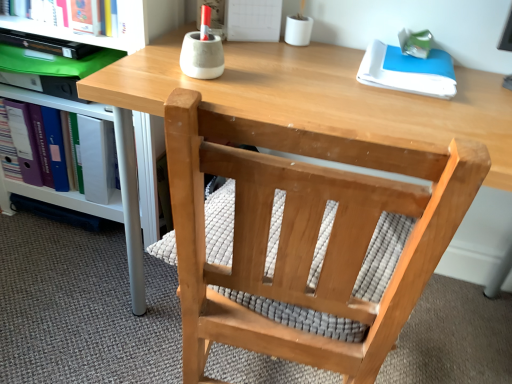
Question: Considering the positions of purple ring-binder at left and white paper at upper right in the image, is purple ring-binder at left wider or thinner than white paper at upper right?

Choices:
 (A) thin
 (B) wide

Answer: (A)

Question: In the image, is purple ring-binder at left positioned in front of or behind white paper at upper right?

Choices:
 (A) behind
 (B) front

Answer: (A)

Question: Estimate the real-world distances between objects in this image. Which object is farther from the purple ring-binder at left?

Choices:
 (A) white glossy shelf at lower left
 (B) natural wood chair at center
 (C) white paper at upper right

Answer: (C)

Question: Which object is the closest to the natural wood chair at center?

Choices:
 (A) white glossy shelf at lower left
 (B) white paper at upper right
 (C) purple ring-binder at left

Answer: (A)